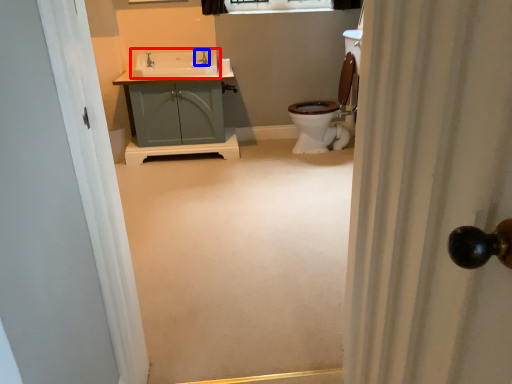
Question: Which object is closer to the camera taking this photo, sink (highlighted by a red box) or tap (highlighted by a blue box)?

Choices:
 (A) sink
 (B) tap

Answer: (A)